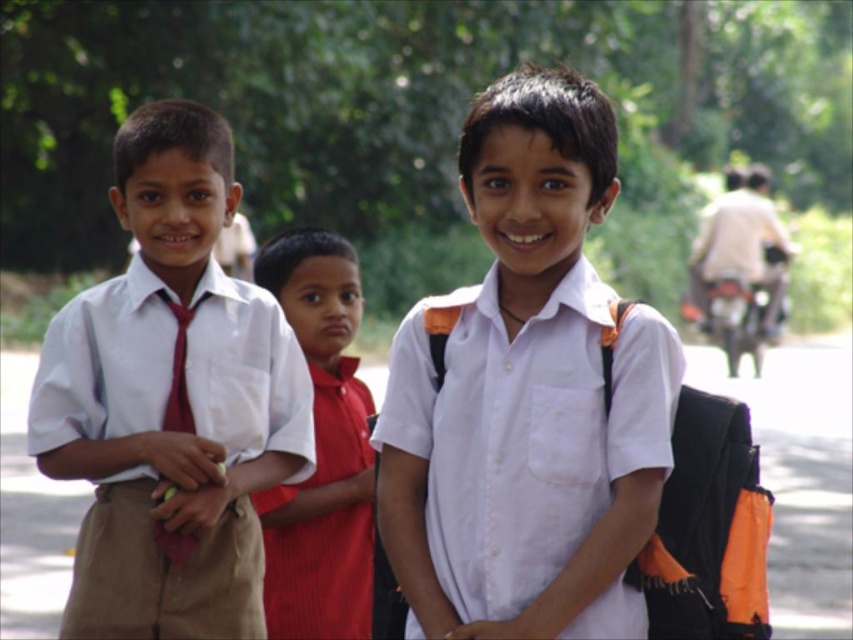
Does matte white shirt at center have a larger size compared to matte red tie at left?

Yes, matte white shirt at center is bigger than matte red tie at left.

Is point (190, 452) positioned before point (177, 368)?

That is True.

I want to click on matte white shirt at center, so click(x=171, y=401).

In order to click on matte white shirt at center in this screenshot , I will do `click(171, 401)`.

Can you confirm if matte white shirt at center is thinner than matte white shirt at left?

Incorrect, matte white shirt at center's width is not less than matte white shirt at left's.

Between point (267, 392) and point (231, 438), which one is positioned in front?

Point (231, 438) is more forward.

The width and height of the screenshot is (853, 640). What are the coordinates of `matte white shirt at center` in the screenshot? It's located at (171, 401).

Looking at this image, is white matte shirt at center thinner than red smooth shirt at center?

Incorrect, white matte shirt at center's width is not less than red smooth shirt at center's.

Can you confirm if white matte shirt at center is positioned to the left of red smooth shirt at center?

Incorrect, white matte shirt at center is not on the left side of red smooth shirt at center.

Where is `white matte shirt at center`? white matte shirt at center is located at coordinates (527, 396).